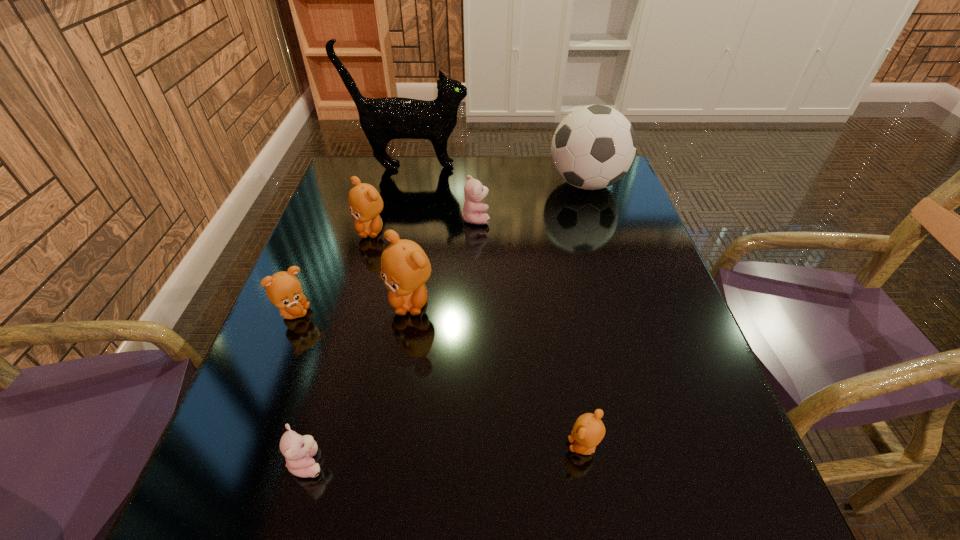
Locate an element on the screen. the farther pink teddy bear is located at coordinates (474, 192).

Where is `the bigger pink teddy bear`? Image resolution: width=960 pixels, height=540 pixels. the bigger pink teddy bear is located at coordinates (474, 192).

Find the location of `the second object from right to left`. the second object from right to left is located at coordinates (588, 431).

In order to click on the smallest brown teddy bear in this screenshot , I will do `click(588, 431)`.

Image resolution: width=960 pixels, height=540 pixels. Identify the location of the smaller pink teddy bear. (298, 450).

Find the location of a particular element. The image size is (960, 540). the nearer pink teddy bear is located at coordinates (298, 450).

Find the location of a particular element. The width and height of the screenshot is (960, 540). vacant space located on the face of the cat is located at coordinates (501, 167).

You are a GUI agent. You are given a task and a screenshot of the screen. Output one action in this format:
    pyautogui.click(x=<x>, y=<y>)
    Task: Click on the vacant space situated on the front of the soccer ball
    This screenshot has height=540, width=960.
    Given the screenshot: What is the action you would take?
    pyautogui.click(x=596, y=217)

Identify the location of blank space located 0.070m on the face of the third brown teddy bear from left to right. tap(403, 347).

Locate an element on the screen. Image resolution: width=960 pixels, height=540 pixels. free region located 0.200m on the face of the fourth tallest object is located at coordinates (351, 299).